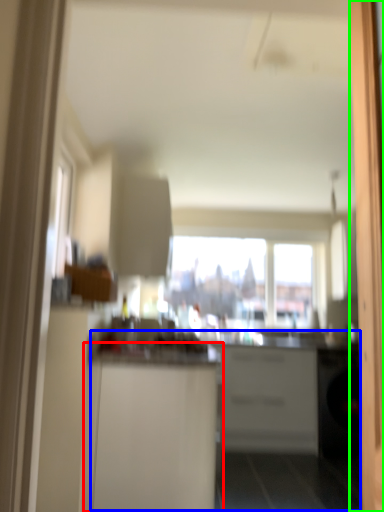
Question: Estimate the real-world distances between objects in this image. Which object is farther from cabinetry (highlighted by a red box), counter (highlighted by a blue box) or screen door (highlighted by a green box)?

Choices:
 (A) counter
 (B) screen door

Answer: (A)